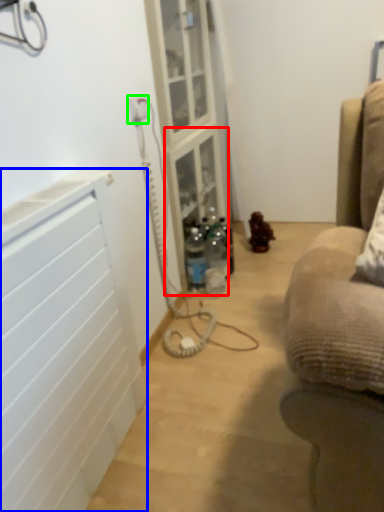
Question: Based on their relative distances, which object is nearer to shelf (highlighted by a red box)? Choose from radiator (highlighted by a blue box) and electric outlet (highlighted by a green box).

Choices:
 (A) radiator
 (B) electric outlet

Answer: (B)